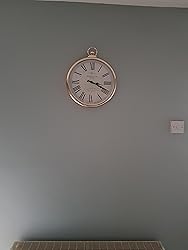
Locate an element on the screen. ceiling is located at coordinates (173, 4).